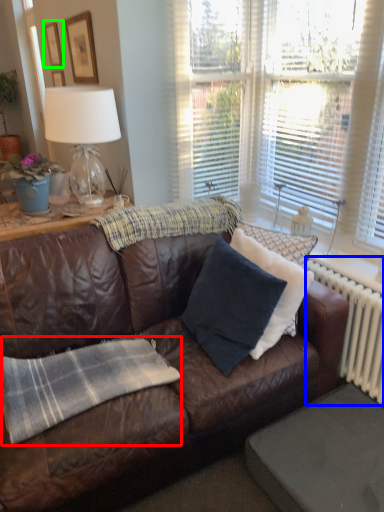
Question: Estimate the real-world distances between objects in this image. Which object is closer to plaid (highlighted by a red box), radiator (highlighted by a blue box) or picture frame (highlighted by a green box)?

Choices:
 (A) radiator
 (B) picture frame

Answer: (A)